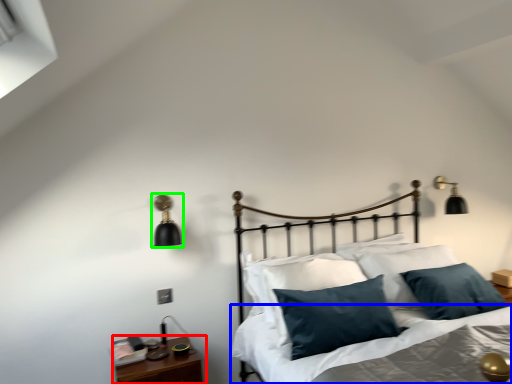
Question: Estimate the real-world distances between objects in this image. Which object is farther from nightstand (highlighted by a red box), sheet (highlighted by a blue box) or lamp (highlighted by a green box)?

Choices:
 (A) sheet
 (B) lamp

Answer: (B)